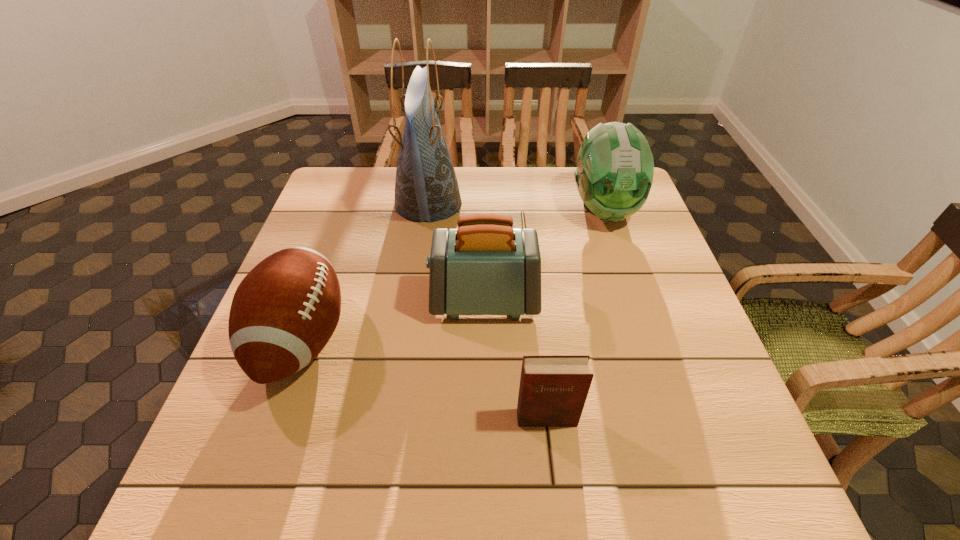
You are a GUI agent. You are given a task and a screenshot of the screen. Output one action in this format:
    pyautogui.click(x=<x>, y=<y>)
    Task: Click on the vacant area at the far left corner of the desktop
    
    Given the screenshot: What is the action you would take?
    pyautogui.click(x=372, y=173)

In the image, there is a desktop. At what (x,y) coordinates should I click in order to perform the action: click on vacant region at the near left corner. Please return your answer as a coordinate pair (x, y). The image size is (960, 540). Looking at the image, I should click on (213, 454).

The width and height of the screenshot is (960, 540). I want to click on free space between the football helmet and the tallest object, so click(x=516, y=206).

Identify the location of empty space between the shortest object and the football. This screenshot has height=540, width=960. (424, 379).

Find the location of a particular element. The width and height of the screenshot is (960, 540). vacant space that is in between the rightmost object and the shortest object is located at coordinates (575, 314).

The image size is (960, 540). Identify the location of free point between the shortest object and the football helmet. (575, 314).

Where is `free spot between the rightmost object and the tallest object`? The height and width of the screenshot is (540, 960). free spot between the rightmost object and the tallest object is located at coordinates (516, 206).

I want to click on free spot between the diary and the toaster, so click(516, 359).

Image resolution: width=960 pixels, height=540 pixels. Find the location of `empty location between the shortest object and the toaster`. empty location between the shortest object and the toaster is located at coordinates (516, 359).

Point out which object is positioned as the nearest to the toaster. Please provide its 2D coordinates. Your answer should be formatted as a tuple, i.e. [(x, y)], where the tuple contains the x and y coordinates of a point satisfying the conditions above.

[(426, 188)]